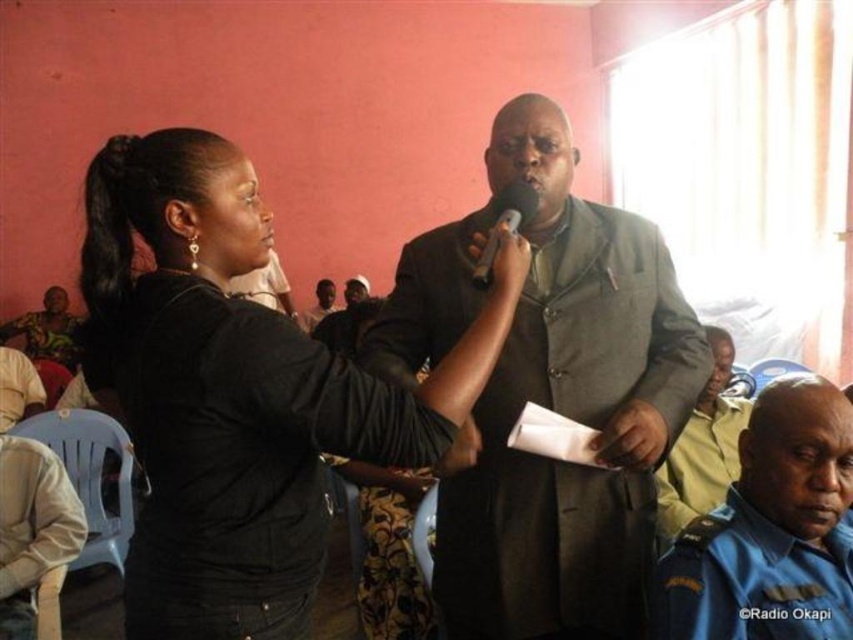
Please provide the 2D coordinates of the light brown uniform at center in the image.

The light brown uniform at center is located at coordinates point (701, 448).

You are organizing a small event and need to place a large decorative item on the table. You have a blue uniform at lower right and a matte black microphone at center. Which object should you choose based on size?

The blue uniform at lower right is bigger than the matte black microphone at center, so you should choose the blue uniform at lower right for placing the large decorative item.

In the scene, there is a point labeled at coordinates (701, 448). What object or feature is located at this point?

The point at coordinates (701, 448) indicates the location of the light brown uniform at center.